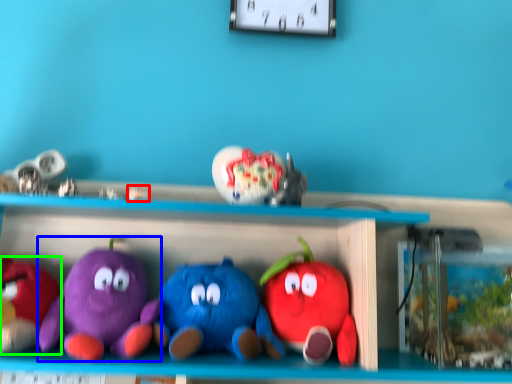
Question: Considering the real-world distances, which object is farthest from toy (highlighted by a red box)? toy (highlighted by a blue box) or toy (highlighted by a green box)?

Choices:
 (A) toy
 (B) toy

Answer: (B)